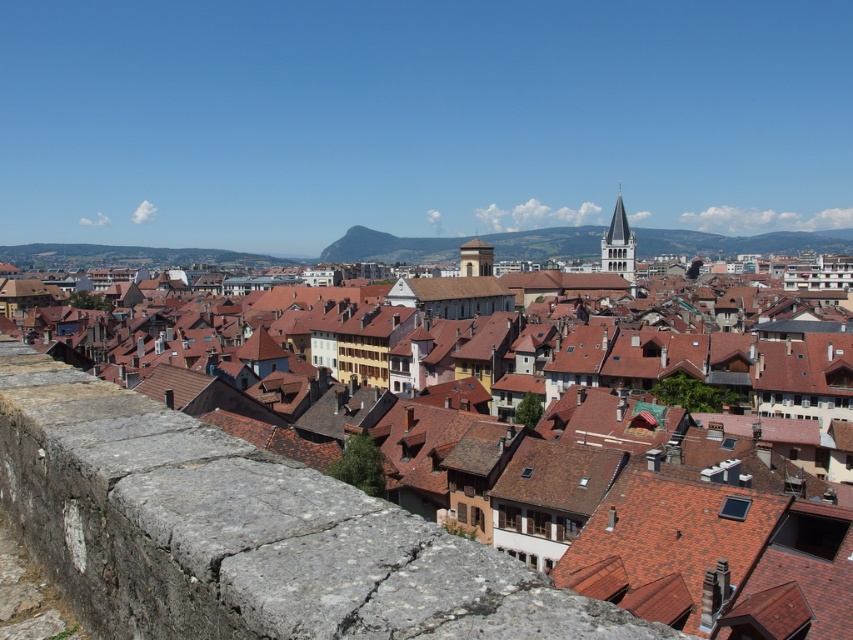
Question: Is stone wall at lower left to the left of smooth white tower at upper center from the viewer's perspective?

Choices:
 (A) no
 (B) yes

Answer: (B)

Question: Which point is farther from the camera taking this photo?

Choices:
 (A) coord(619,269)
 (B) coord(54,572)

Answer: (A)

Question: Does stone wall at lower left have a greater width compared to smooth white tower at upper center?

Choices:
 (A) yes
 (B) no

Answer: (B)

Question: Among these points, which one is nearest to the camera?

Choices:
 (A) (73, 467)
 (B) (622, 243)

Answer: (A)

Question: Is stone wall at lower left closer to camera compared to smooth white tower at upper center?

Choices:
 (A) no
 (B) yes

Answer: (B)